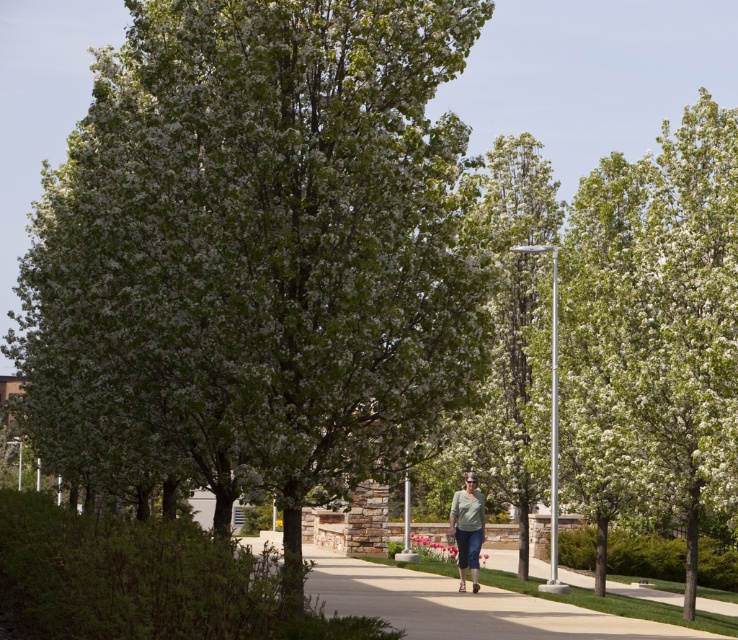
Question: Does green leafy tree at center have a lesser width compared to smooth concrete sidewalk at center?

Choices:
 (A) no
 (B) yes

Answer: (A)

Question: Where is green leafy tree at center located in relation to smooth concrete sidewalk at center in the image?

Choices:
 (A) above
 (B) below

Answer: (A)

Question: Considering the real-world distances, which object is farthest from the smooth concrete sidewalk at center?

Choices:
 (A) light green fabric shirt at center
 (B) green leafy tree at center

Answer: (B)

Question: Considering the real-world distances, which object is closest to the green leafy tree at center?

Choices:
 (A) light green fabric shirt at center
 (B) smooth concrete sidewalk at center

Answer: (B)

Question: Among these points, which one is farthest from the camera?

Choices:
 (A) (275, 216)
 (B) (475, 552)
 (C) (362, 604)

Answer: (B)

Question: Is green leafy tree at center smaller than smooth concrete sidewalk at center?

Choices:
 (A) yes
 (B) no

Answer: (B)